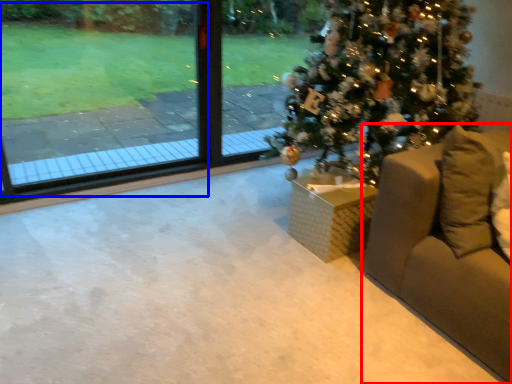
Question: Which point is further to the camera, furniture (highlighted by a red box) or window screen (highlighted by a blue box)?

Choices:
 (A) furniture
 (B) window screen

Answer: (B)